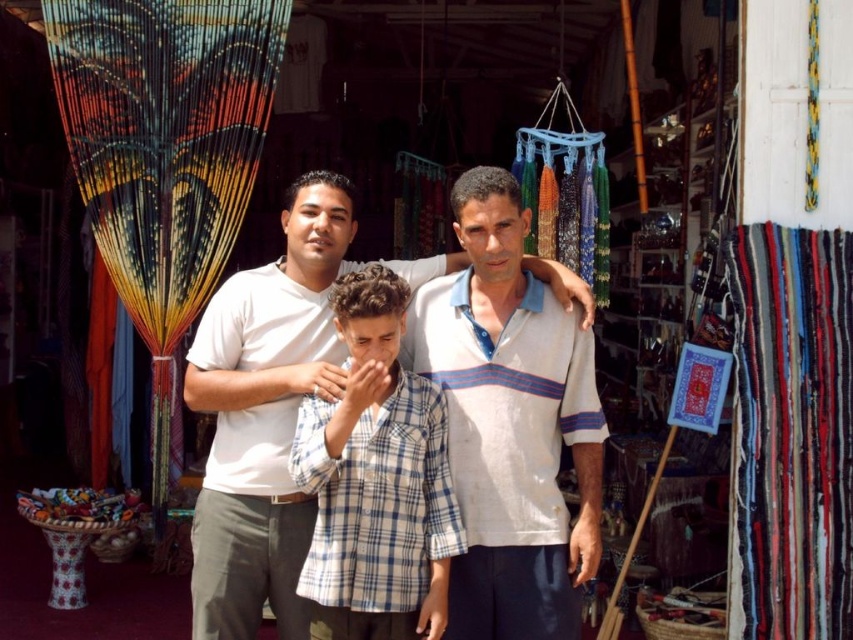
You are a photographer trying to position a new subject between the white striped polo shirt at center and the person on the right. Based on their current positions, where should you place the new subject to ensure they are centered between them?

The white striped polo shirt at center is located at point (509, 422). To center the new subject between them, calculate the midpoint between the two coordinates and position the subject there.

You are a photographer setting up a shot of the two people in the scene. You need to position a backdrop that is 1.2 meters wide. The backdrop must be placed behind both the white striped shirt at center and the blue plaid shirt at center. Based on their positions, will the backdrop be wide enough to cover both individuals?

The white striped shirt at center might be wider than blue plaid shirt at center, so the backdrop needs to be at least as wide as the wider of the two. Since the backdrop is 1.2 meters wide, it depends on the actual width of the individuals. However, since the description only states that the white striped shirt at center might be wider, but not the exact measurement, we cannot confirm if 1.2 meters is sufficient without more information.